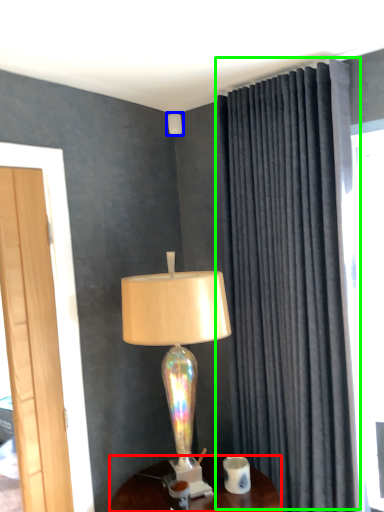
Question: Based on their relative distances, which object is nearer to desk (highlighted by a red box)? Choose from lamp (highlighted by a blue box) and curtain (highlighted by a green box).

Choices:
 (A) lamp
 (B) curtain

Answer: (B)